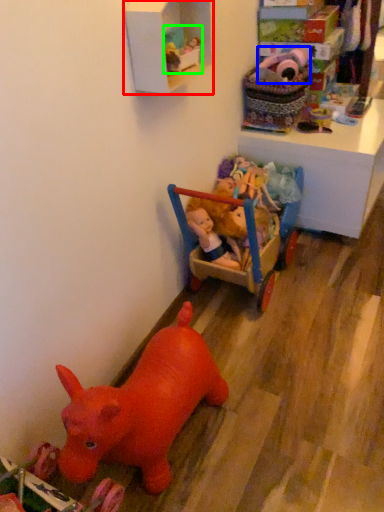
Question: Based on their relative distances, which object is nearer to shelf (highlighted by a red box)? Choose from toy (highlighted by a blue box) and toy (highlighted by a green box).

Choices:
 (A) toy
 (B) toy

Answer: (B)